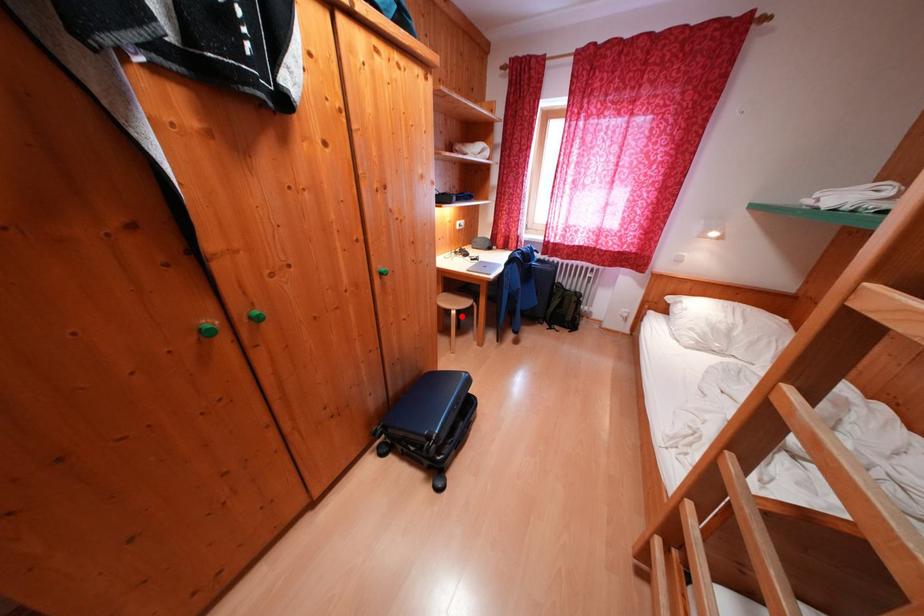
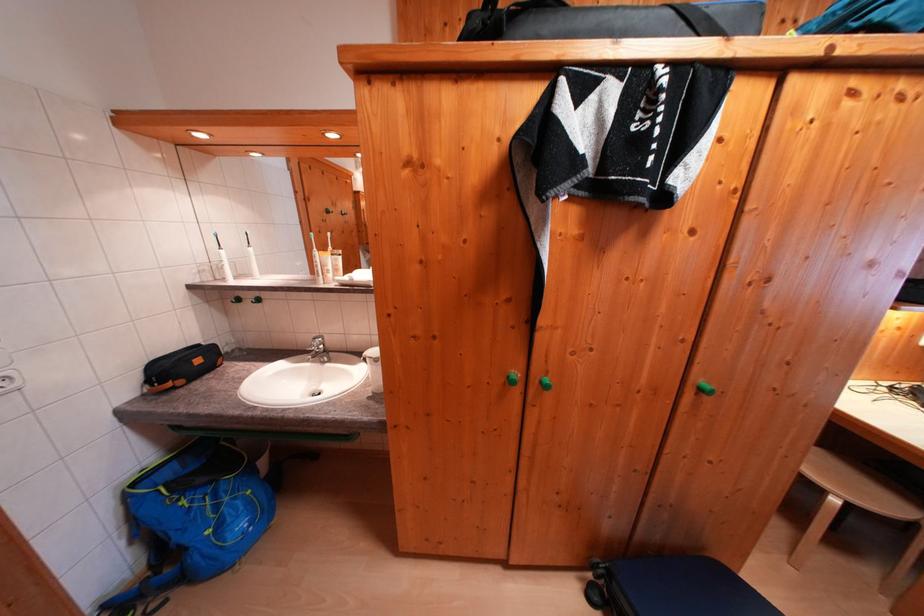
Where in the second image is the point corresponding to the highlighted location from the first image?

(843, 505)